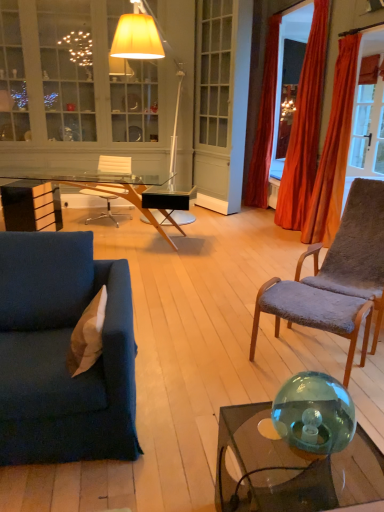
The width and height of the screenshot is (384, 512). I want to click on vacant space positioned to the left of transparent glass sphere at lower right, so click(259, 448).